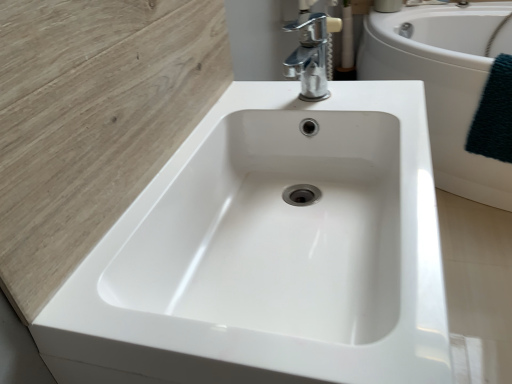
Question: Is white glossy sink at center bigger than white glossy bathtub at center?

Choices:
 (A) no
 (B) yes

Answer: (A)

Question: Can you confirm if white glossy sink at center is positioned to the left of white glossy bathtub at center?

Choices:
 (A) no
 (B) yes

Answer: (B)

Question: Is white glossy bathtub at center completely or partially inside white glossy sink at center?

Choices:
 (A) yes
 (B) no

Answer: (B)

Question: Is white glossy bathtub at center at the back of white glossy sink at center?

Choices:
 (A) no
 (B) yes

Answer: (A)

Question: Does white glossy sink at center have a greater width compared to white glossy bathtub at center?

Choices:
 (A) yes
 (B) no

Answer: (B)

Question: Is white glossy sink at center positioned before white glossy bathtub at center?

Choices:
 (A) no
 (B) yes

Answer: (B)

Question: From a real-world perspective, does white glossy sink at center stand above dark green textured towel at right?

Choices:
 (A) yes
 (B) no

Answer: (A)

Question: Is white glossy sink at center thinner than dark green textured towel at right?

Choices:
 (A) yes
 (B) no

Answer: (B)

Question: Is dark green textured towel at right located within white glossy sink at center?

Choices:
 (A) yes
 (B) no

Answer: (B)

Question: Is white glossy sink at center directly adjacent to dark green textured towel at right?

Choices:
 (A) no
 (B) yes

Answer: (A)

Question: Is white glossy sink at center positioned before dark green textured towel at right?

Choices:
 (A) yes
 (B) no

Answer: (A)

Question: Is white glossy sink at center wider than dark green textured towel at right?

Choices:
 (A) no
 (B) yes

Answer: (B)

Question: Can you confirm if chrome metallic faucet at upper center is taller than white glossy bathtub at center?

Choices:
 (A) no
 (B) yes

Answer: (A)